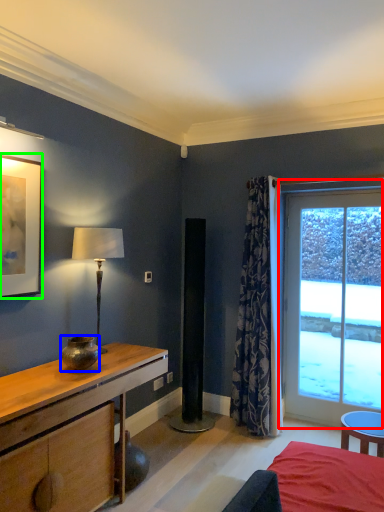
Question: Considering the real-world distances, which object is farthest from window (highlighted by a red box)? vase (highlighted by a blue box) or picture frame (highlighted by a green box)?

Choices:
 (A) vase
 (B) picture frame

Answer: (B)